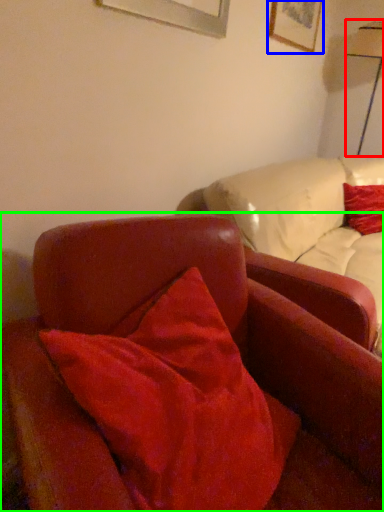
Question: Estimate the real-world distances between objects in this image. Which object is farther from table lamp (highlighted by a red box), picture frame (highlighted by a blue box) or chair (highlighted by a green box)?

Choices:
 (A) picture frame
 (B) chair

Answer: (B)